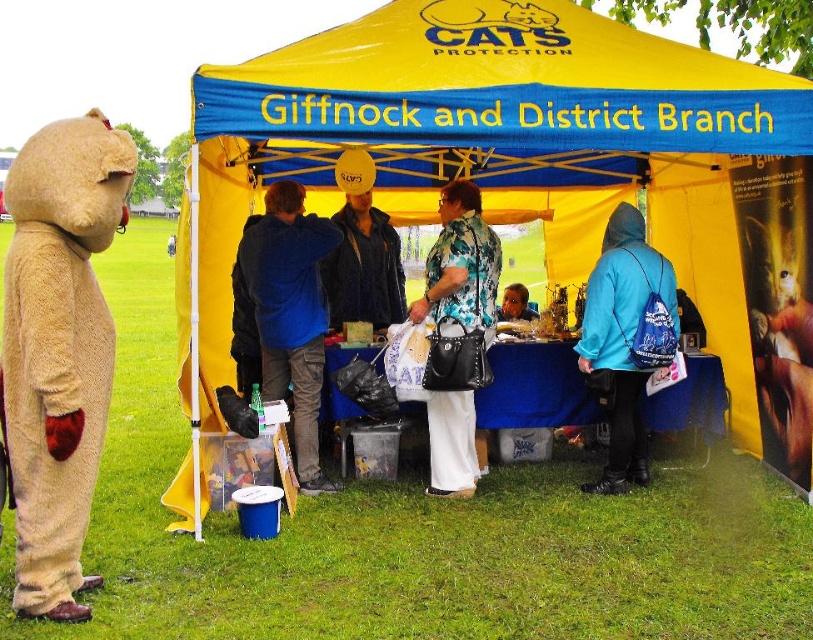
You are standing at the point marked as point (624, 474) inside the CATS Protection tent. You want to exit the tent to the grassy field outside. Is the entrance to the tent within your immediate vicinity?

The point (624, 474) is 18.14 feet away from the viewer, so the entrance to the tent is not within immediate vicinity.

You are a visitor at the event and want to pick up both the blue fabric backpack at lower right and the blue denim jacket at center. Which item should you approach first if you want to collect them in the order they are positioned from your current viewpoint?

The blue fabric backpack at lower right is in front of the blue denim jacket at center, so you should pick up the blue fabric backpack at lower right first.

You are a visitor at the CATS Protection event. You see the fuzzy beige bear at left and the floral fabric blouse at center. Which object is positioned lower in the image?

The fuzzy beige bear at left is located below the floral fabric blouse at center, so it is positioned lower in the image.